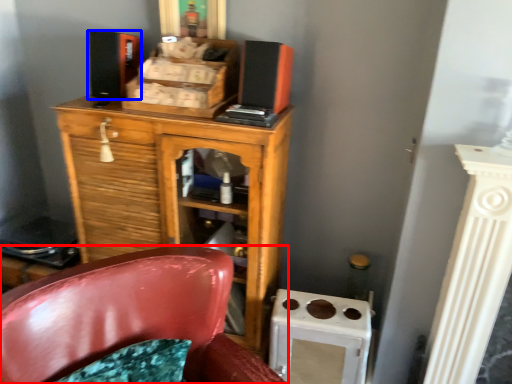
Question: Which object is further to the camera taking this photo, chair (highlighted by a red box) or speaker (highlighted by a blue box)?

Choices:
 (A) chair
 (B) speaker

Answer: (B)